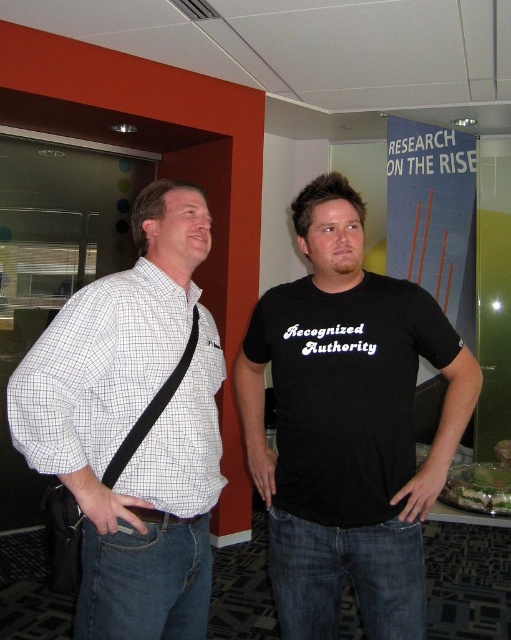
Question: Which point appears closest to the camera in this image?

Choices:
 (A) (286, 484)
 (B) (197, 577)

Answer: (B)

Question: Is black cotton t-shirt at center bigger than white checkered shirt at center?

Choices:
 (A) yes
 (B) no

Answer: (A)

Question: Is black cotton t-shirt at center to the left of white checkered shirt at center from the viewer's perspective?

Choices:
 (A) yes
 (B) no

Answer: (B)

Question: Which point is farther to the camera?

Choices:
 (A) black cotton t-shirt at center
 (B) white checkered shirt at center

Answer: (A)

Question: Is black cotton t-shirt at center positioned before white checkered shirt at center?

Choices:
 (A) no
 (B) yes

Answer: (A)